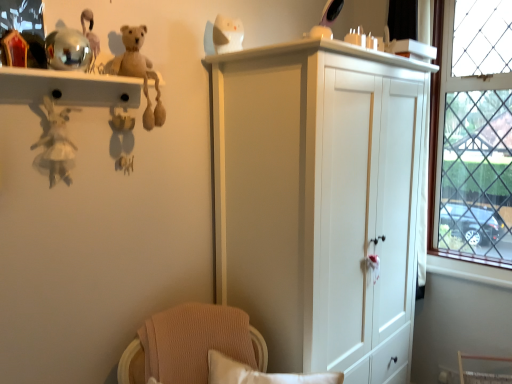
Question: Can you confirm if clear glass window at right is taller than metallic gold toy at upper left, the second toy when ordered from left to right?

Choices:
 (A) yes
 (B) no

Answer: (A)

Question: From a real-world perspective, does clear glass window at right stand above metallic gold toy at upper left, which appears as the 4th toy when viewed from the right?

Choices:
 (A) no
 (B) yes

Answer: (A)

Question: From the image's perspective, is clear glass window at right below metallic gold toy at upper left, which appears as the 4th toy when viewed from the right?

Choices:
 (A) no
 (B) yes

Answer: (A)

Question: Considering the relative positions of clear glass window at right and metallic gold toy at upper left, the second toy when ordered from left to right, in the image provided, is clear glass window at right to the right of metallic gold toy at upper left, the second toy when ordered from left to right, from the viewer's perspective?

Choices:
 (A) no
 (B) yes

Answer: (B)

Question: Is clear glass window at right far from metallic gold toy at upper left, the second toy when ordered from left to right?

Choices:
 (A) no
 (B) yes

Answer: (B)

Question: Looking at their shapes, would you say clear glass window at right is wider or thinner than white fabric doll at left, the 5th toy viewed from the right?

Choices:
 (A) wide
 (B) thin

Answer: (A)

Question: In the image, is clear glass window at right on the left side or the right side of white fabric doll at left, the 5th toy viewed from the right?

Choices:
 (A) right
 (B) left

Answer: (A)

Question: Considering the positions of point (481, 89) and point (52, 152), is point (481, 89) closer or farther from the camera than point (52, 152)?

Choices:
 (A) farther
 (B) closer

Answer: (A)

Question: Do you think clear glass window at right is within white fabric doll at left, the 5th toy viewed from the right, or outside of it?

Choices:
 (A) inside
 (B) outside

Answer: (B)

Question: Based on their sizes in the image, would you say white fabric doll at left, the first toy in the left-to-right sequence, is bigger or smaller than shiny plastic mirror at upper center, which is counted as the first toy, starting from the right?

Choices:
 (A) small
 (B) big

Answer: (B)

Question: Is white fabric doll at left, the 5th toy viewed from the right, situated inside shiny plastic mirror at upper center, which is counted as the first toy, starting from the right, or outside?

Choices:
 (A) inside
 (B) outside

Answer: (B)

Question: Does point (59, 130) appear closer or farther from the camera than point (331, 4)?

Choices:
 (A) farther
 (B) closer

Answer: (B)

Question: Considering the positions of white fabric doll at left, the first toy in the left-to-right sequence, and shiny plastic mirror at upper center, arranged as the 5th toy when viewed from the left, in the image, is white fabric doll at left, the first toy in the left-to-right sequence, wider or thinner than shiny plastic mirror at upper center, arranged as the 5th toy when viewed from the left,?

Choices:
 (A) thin
 (B) wide

Answer: (A)

Question: From a real-world perspective, relative to metallic reflective shelf at upper left, is white glossy cat at upper center, acting as the second toy starting from the right, vertically above or below?

Choices:
 (A) below
 (B) above

Answer: (B)

Question: Relative to metallic reflective shelf at upper left, is white glossy cat at upper center, acting as the second toy starting from the right, in front or behind?

Choices:
 (A) behind
 (B) front

Answer: (A)